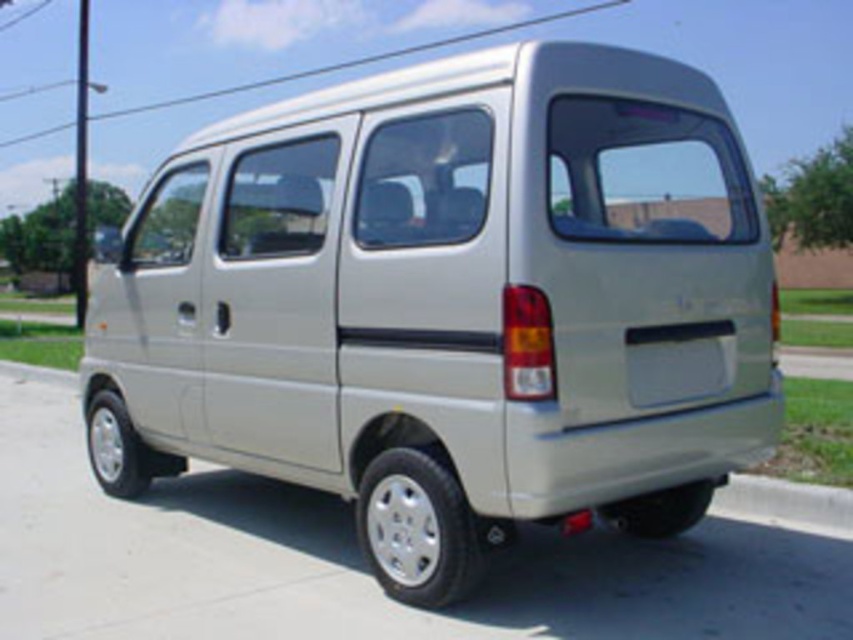
How distant is satin beige van at center from gray concrete curb at lower right?

satin beige van at center and gray concrete curb at lower right are 4.96 feet apart.

Can you confirm if satin beige van at center is thinner than gray concrete curb at lower right?

In fact, satin beige van at center might be wider than gray concrete curb at lower right.

Who is more forward, (428, 436) or (834, 532)?

Point (428, 436)

Where is `satin beige van at center`? The width and height of the screenshot is (853, 640). satin beige van at center is located at coordinates (450, 305).